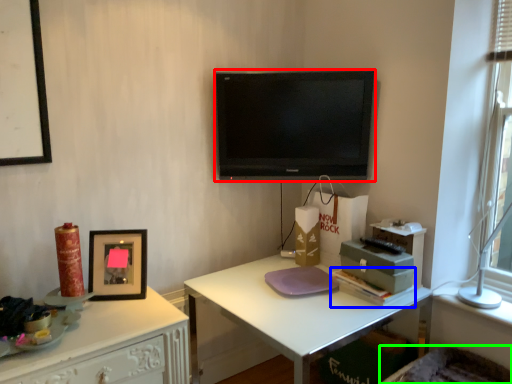
Question: Which is nearer to the television (highlighted by a red box)? book (highlighted by a blue box) or swivel chair (highlighted by a green box).

Choices:
 (A) book
 (B) swivel chair

Answer: (A)